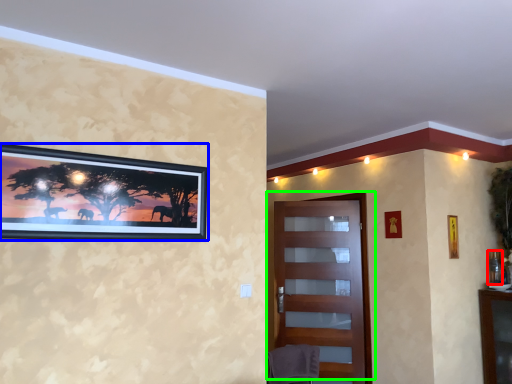
Question: Based on their relative distances, which object is nearer to picture frame (highlighted by a red box)? Choose from picture frame (highlighted by a blue box) and door (highlighted by a green box).

Choices:
 (A) picture frame
 (B) door

Answer: (B)